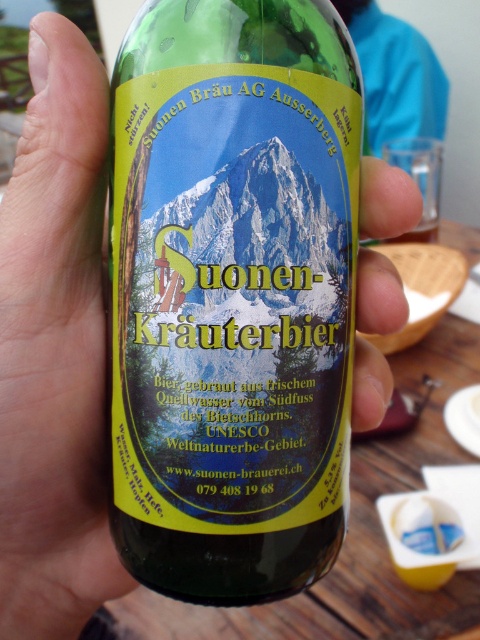
In the scene shown: Who is lower down, green glass bottle at center or transparent plastic bottle at center?

transparent plastic bottle at center is below.

Is point (123, 545) behind point (55, 285)?

No, (123, 545) is in front of (55, 285).

Between point (203, 147) and point (80, 291), which one is positioned behind?

The point (80, 291) is more distant.

Where is `green glass bottle at center`? green glass bottle at center is located at coordinates (231, 294).